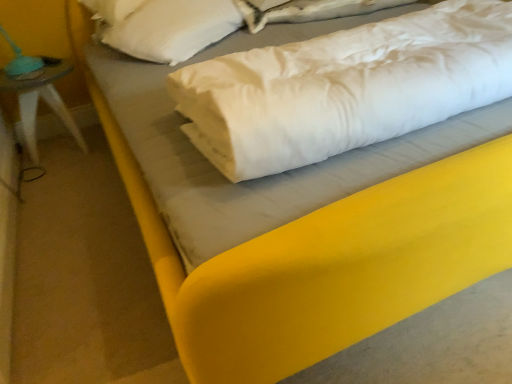
Image resolution: width=512 pixels, height=384 pixels. In order to click on free spot below teal fabric lampshade at left (from a real-world perspective) in this screenshot , I will do `click(57, 150)`.